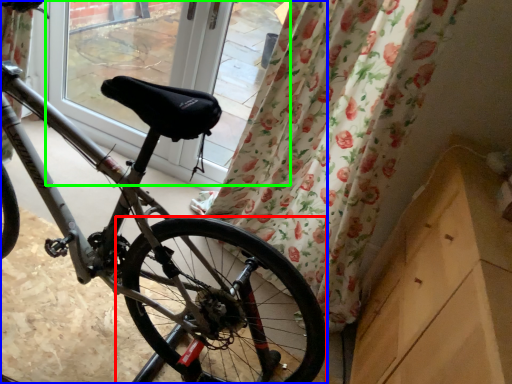
Question: Which is nearer to the wheel (highlighted by a red box)? bicycle (highlighted by a blue box) or window screen (highlighted by a green box).

Choices:
 (A) bicycle
 (B) window screen

Answer: (A)